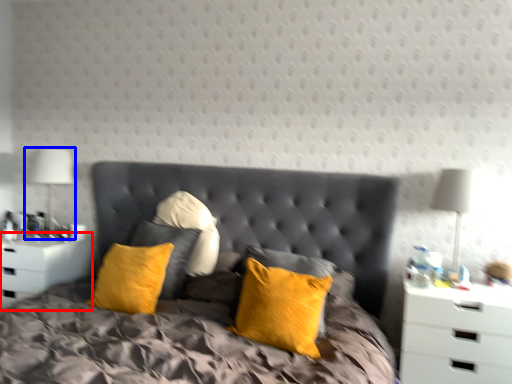
Question: Which point is closer to the camera, nightstand (highlighted by a red box) or bedside lamp (highlighted by a blue box)?

Choices:
 (A) nightstand
 (B) bedside lamp

Answer: (A)